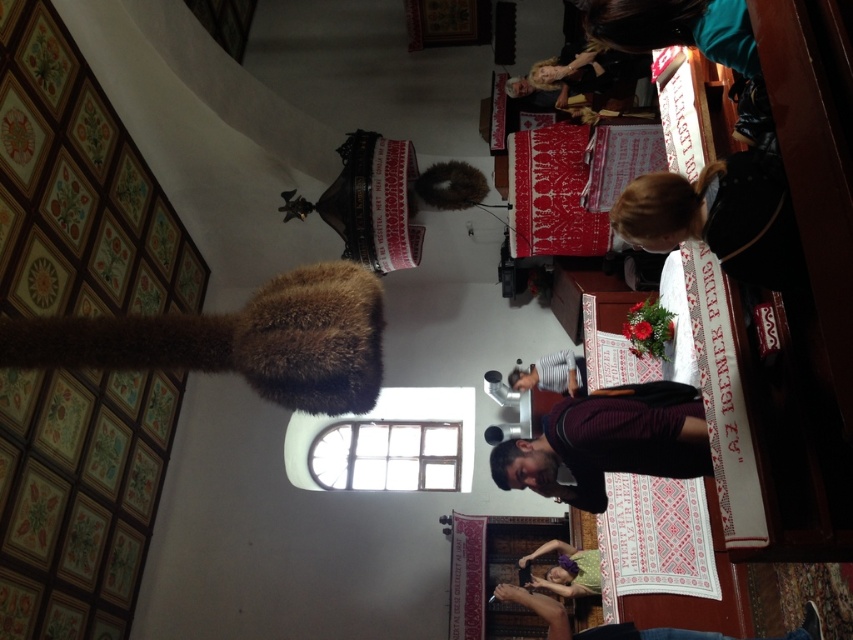
You are organizing a cultural event and need to place a decorative item on the table. The wooden at center and the brown furry hat at center are both on the table. Which object has a larger width?

The wooden at center has a larger width than the brown furry hat at center according to the description.